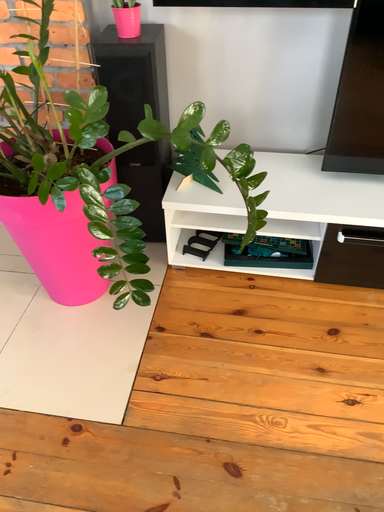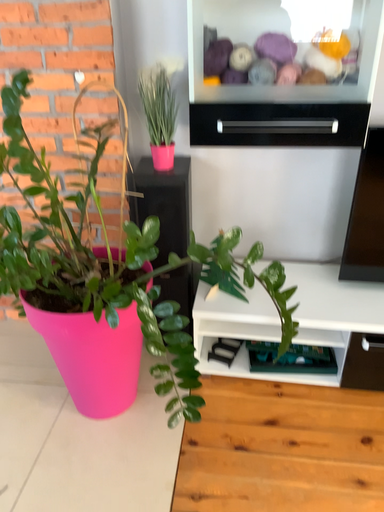
Question: Which way did the camera rotate in the video?

Choices:
 (A) rotated downward
 (B) rotated upward

Answer: (B)